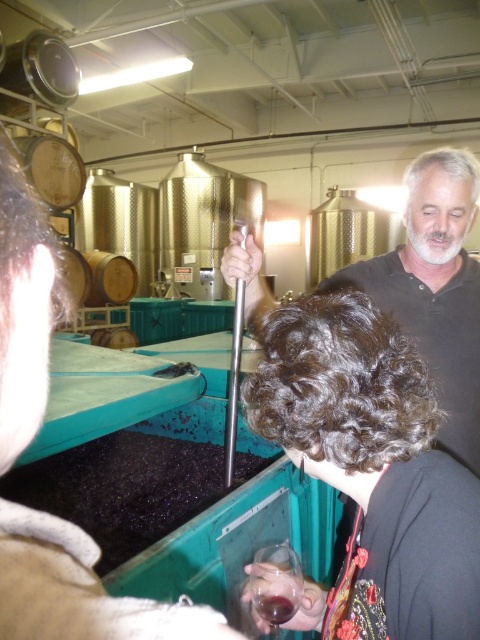
Between dark curly hair at center and black matte shirt at center, which one is positioned higher?

Positioned higher is black matte shirt at center.

Looking at this image, can you confirm if dark curly hair at center is positioned below black matte shirt at center?

Indeed, dark curly hair at center is positioned under black matte shirt at center.

Measure the distance between point (332, 598) and camera.

34.80 inches

You are a GUI agent. You are given a task and a screenshot of the screen. Output one action in this format:
    pyautogui.click(x=<x>, y=<y>)
    Task: Click on the dark curly hair at center
    
    Given the screenshot: What is the action you would take?
    tap(372, 468)

Does black matte shirt at center appear on the right side of transparent glass at lower center?

Indeed, black matte shirt at center is positioned on the right side of transparent glass at lower center.

Does black matte shirt at center lie behind transparent glass at lower center?

Yes, it is.

What do you see at coordinates (434, 289) in the screenshot?
I see `black matte shirt at center` at bounding box center [434, 289].

You are a GUI agent. You are given a task and a screenshot of the screen. Output one action in this format:
    pyautogui.click(x=<x>, y=<y>)
    Task: Click on the black matte shirt at center
    This screenshot has width=480, height=640.
    Given the screenshot: What is the action you would take?
    pyautogui.click(x=434, y=289)

Is transparent glass at lower center to the right of translucent glass at center from the viewer's perspective?

Correct, you'll find transparent glass at lower center to the right of translucent glass at center.

I want to click on transparent glass at lower center, so click(276, 582).

Find the location of a particular element. The height and width of the screenshot is (640, 480). transparent glass at lower center is located at coordinates (276, 582).